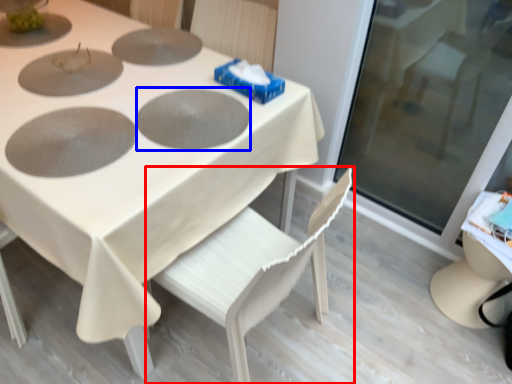
Question: Which object is further to the camera taking this photo, chair (highlighted by a red box) or pizza pan (highlighted by a blue box)?

Choices:
 (A) chair
 (B) pizza pan

Answer: (B)